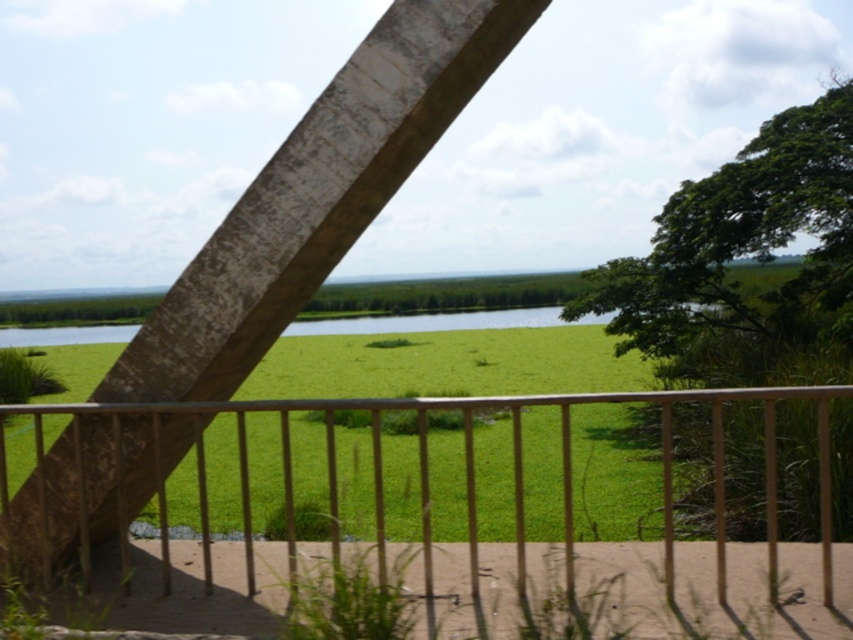
Question: Can you confirm if metallic silver balustrade at center is wider than green grass at lower center?

Choices:
 (A) no
 (B) yes

Answer: (A)

Question: Which of the following is the farthest from the observer?

Choices:
 (A) (350, 332)
 (B) (157, 499)

Answer: (A)

Question: Is metallic silver balustrade at center positioned before green grass at lower center?

Choices:
 (A) yes
 (B) no

Answer: (A)

Question: Which point appears farthest from the camera in this image?

Choices:
 (A) (564, 321)
 (B) (328, 472)

Answer: (A)

Question: Is metallic silver balustrade at center in front of green grass at lower center?

Choices:
 (A) no
 (B) yes

Answer: (B)